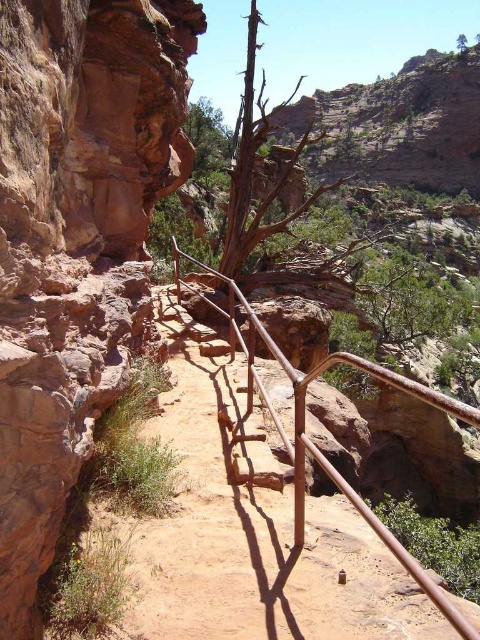
Is rustic stone cliff at left below rusty metal rail at center?

No, rustic stone cliff at left is not below rusty metal rail at center.

Is rustic stone cliff at left to the right of rusty metal rail at center from the viewer's perspective?

Incorrect, rustic stone cliff at left is not on the right side of rusty metal rail at center.

Describe the element at coordinates (75, 243) in the screenshot. Image resolution: width=480 pixels, height=640 pixels. I see `rustic stone cliff at left` at that location.

Locate an element on the screen. The width and height of the screenshot is (480, 640). rustic stone cliff at left is located at coordinates (75, 243).